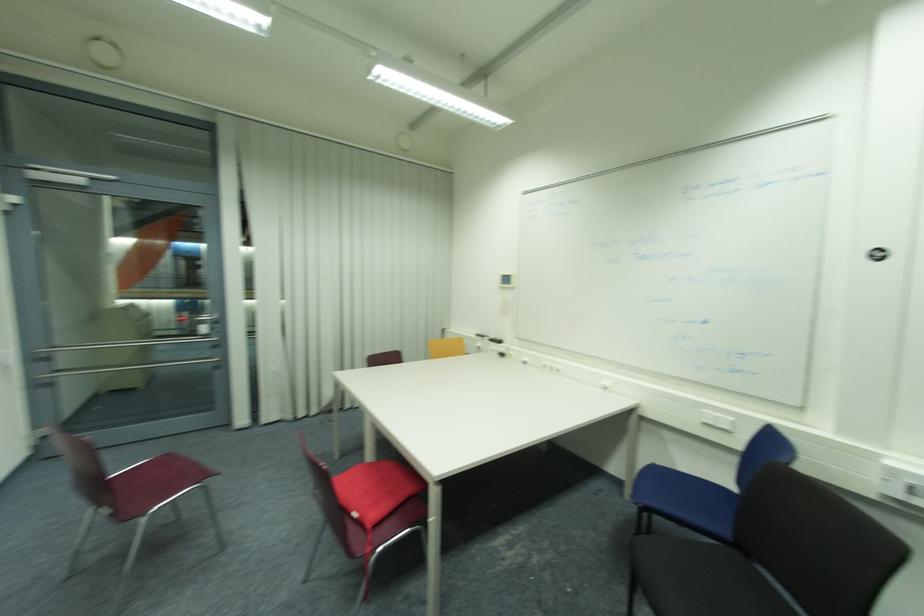
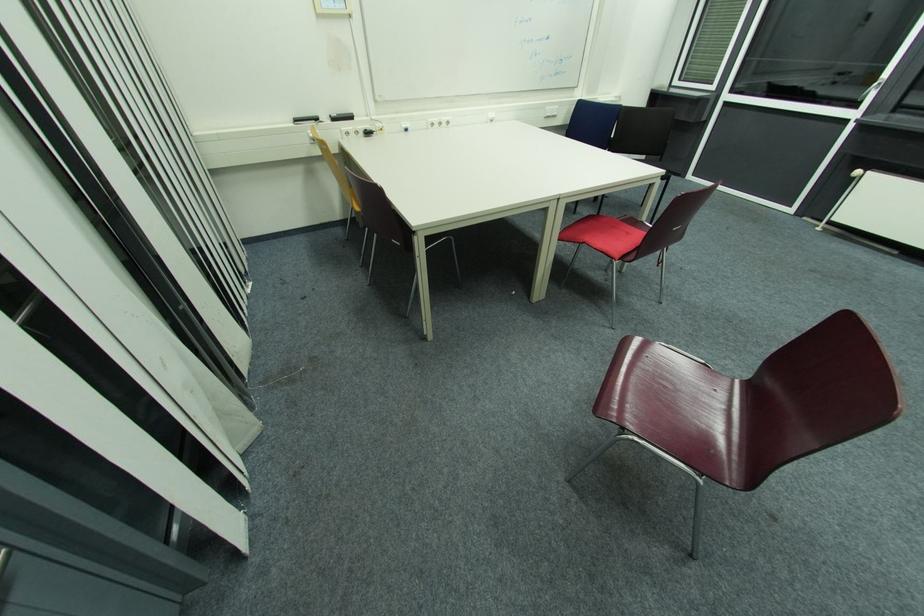
In the second image, find the point that corresponds to (494,341) in the first image.

(337, 121)